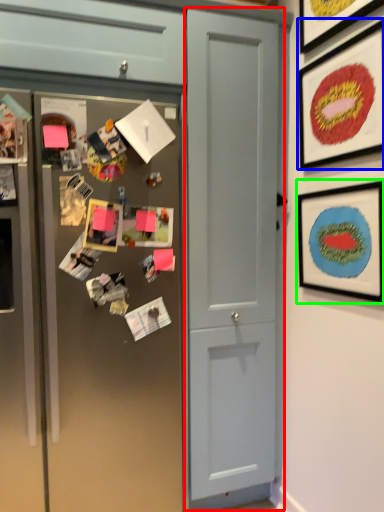
Question: Considering the real-world distances, which object is closest to door (highlighted by a red box)? picture frame (highlighted by a blue box) or picture frame (highlighted by a green box).

Choices:
 (A) picture frame
 (B) picture frame

Answer: (B)